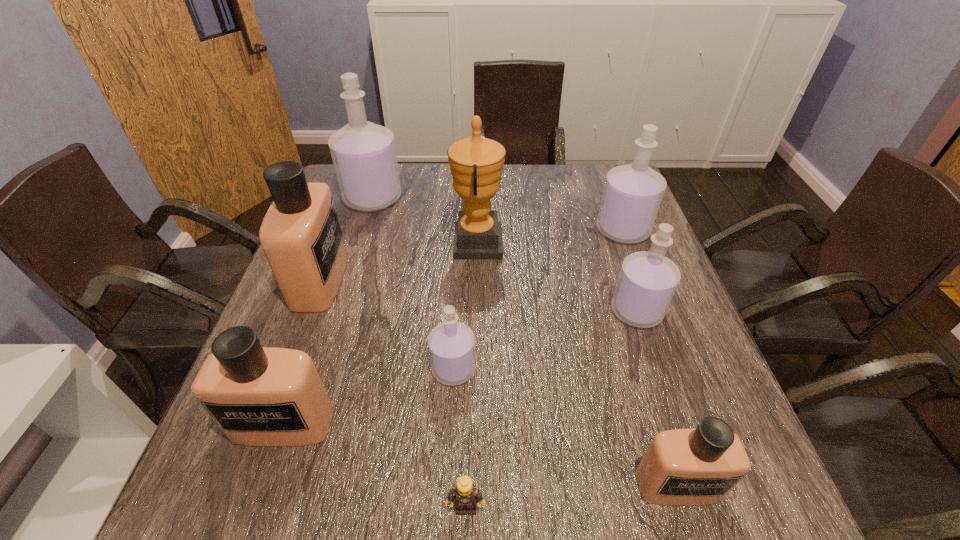
Identify which perfume is the fifth closest to the third smallest purple perfume. Please provide its 2D coordinates. Your answer should be formatted as a tuple, i.e. [(x, y)], where the tuple contains the x and y coordinates of a point satisfying the conditions above.

[(301, 236)]

Select which perfume is the sixth closest to the second nearest perfume. Please provide its 2D coordinates. Your answer should be formatted as a tuple, i.e. [(x, y)], where the tuple contains the x and y coordinates of a point satisfying the conditions above.

[(632, 194)]

Point out which purple perfume is positioned as the third nearest to the second smallest purple perfume. Please provide its 2D coordinates. Your answer should be formatted as a tuple, i.e. [(x, y)], where the tuple contains the x and y coordinates of a point satisfying the conditions above.

[(363, 153)]

Select which purple perfume appears as the closest to the second purple perfume from left to right. Please provide its 2D coordinates. Your answer should be formatted as a tuple, i.e. [(x, y)], where the tuple contains the x and y coordinates of a point satisfying the conditions above.

[(647, 282)]

Select which beige perfume is the closest to the award. Please provide its 2D coordinates. Your answer should be formatted as a tuple, i.e. [(x, y)], where the tuple contains the x and y coordinates of a point satisfying the conditions above.

[(301, 236)]

Where is `beige perfume that is the second closest one to the Lego`? This screenshot has height=540, width=960. beige perfume that is the second closest one to the Lego is located at coordinates (682, 467).

Find the location of a particular element. The height and width of the screenshot is (540, 960). vacant position in the image that satisfies the following two spatial constraints: 1. at the front of the award with handles; 2. on the front label of the seventh farthest object is located at coordinates (476, 424).

Where is `free space in the image that satisfies the following two spatial constraints: 1. at the front of the award with handles; 2. on the front label of the seventh farthest object`? The width and height of the screenshot is (960, 540). free space in the image that satisfies the following two spatial constraints: 1. at the front of the award with handles; 2. on the front label of the seventh farthest object is located at coordinates (476, 424).

Where is `vacant position in the image that satisfies the following two spatial constraints: 1. on the front label of the second nearest purple perfume; 2. on the right side of the biggest beige perfume`? This screenshot has height=540, width=960. vacant position in the image that satisfies the following two spatial constraints: 1. on the front label of the second nearest purple perfume; 2. on the right side of the biggest beige perfume is located at coordinates (308, 311).

Image resolution: width=960 pixels, height=540 pixels. In order to click on vacant area that satisfies the following two spatial constraints: 1. at the front of the award with handles; 2. on the right side of the second nearest purple perfume in this screenshot , I will do `click(476, 311)`.